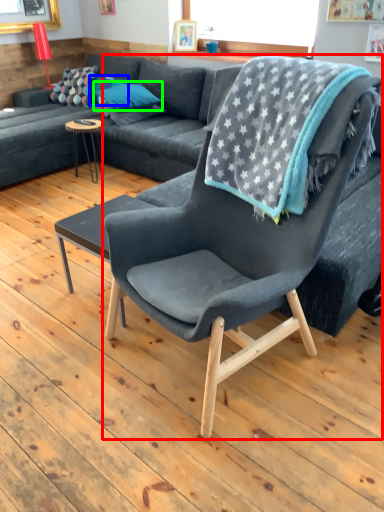
Question: Which object is the farthest from chair (highlighted by a red box)? Choose among these: pillow (highlighted by a blue box) or pillow (highlighted by a green box).

Choices:
 (A) pillow
 (B) pillow

Answer: (A)